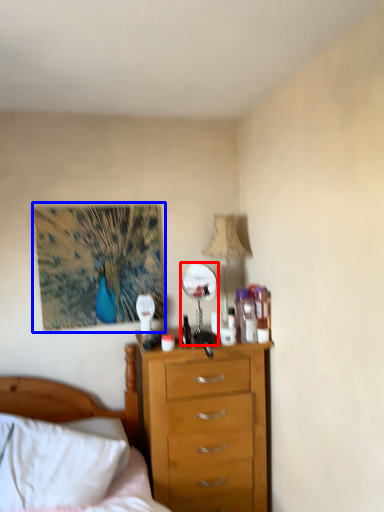
Question: Which point is closer to the camera, mirror (highlighted by a red box) or picture frame (highlighted by a blue box)?

Choices:
 (A) mirror
 (B) picture frame

Answer: (A)